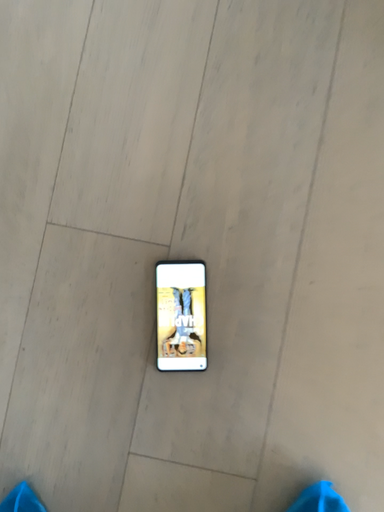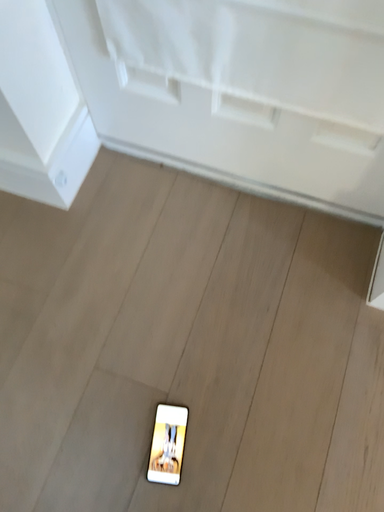
Question: How did the camera likely rotate when shooting the video?

Choices:
 (A) rotated downward
 (B) rotated upward

Answer: (B)